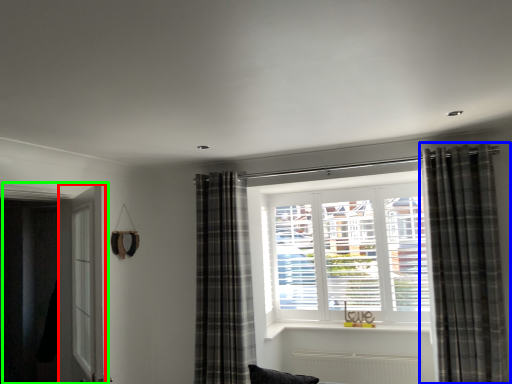
Question: Which is nearer to the screen door (highlighted by a red box)? curtain (highlighted by a blue box) or door (highlighted by a green box).

Choices:
 (A) curtain
 (B) door

Answer: (B)